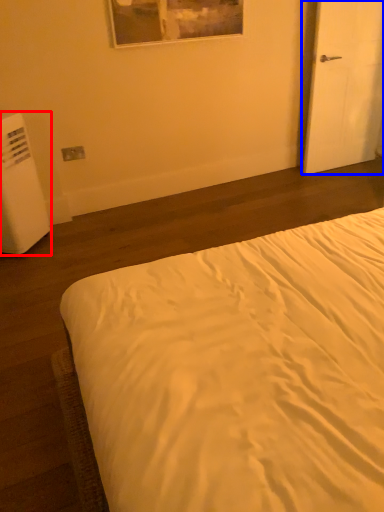
Question: Which of the following is the farthest to the observer, water heater (highlighted by a red box) or door (highlighted by a blue box)?

Choices:
 (A) water heater
 (B) door

Answer: (B)